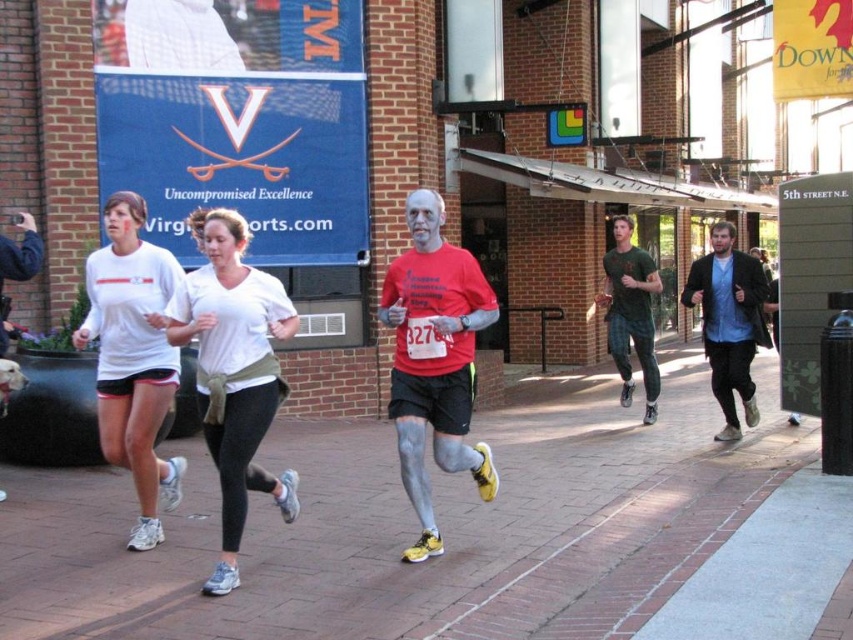
From the picture: You are a runner in the race and you want to step onto the brick pavement at center. Which direction should you move relative to the blue cotton shirt at right?

The brick pavement at center is located below the blue cotton shirt at right. So you should move downward from the blue cotton shirt at right to reach the brick pavement at center.